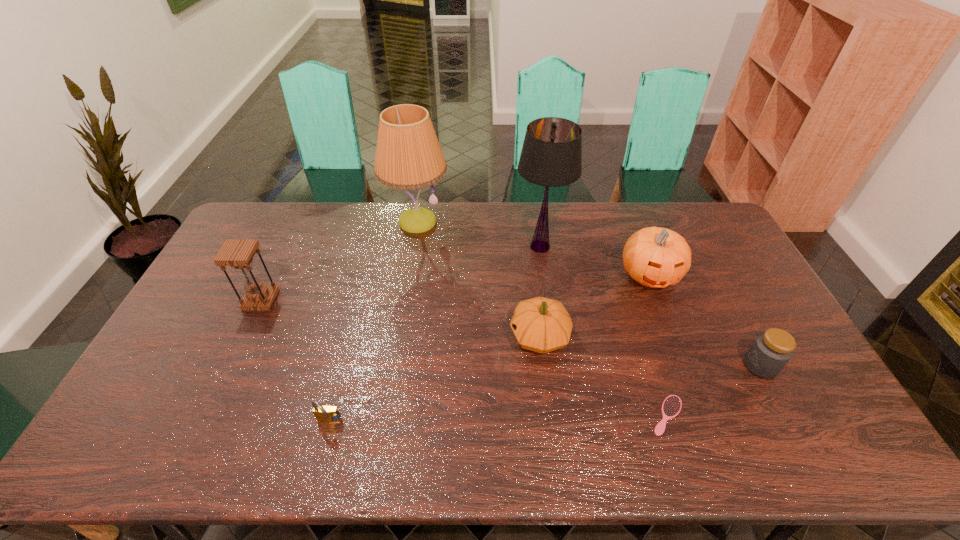
The height and width of the screenshot is (540, 960). Find the location of `free space located on the surface of the rightmost object near the warning symbol`. free space located on the surface of the rightmost object near the warning symbol is located at coordinates (630, 366).

What are the coordinates of `vacant area situated 0.070m on the side with the combination dials of the padlock` in the screenshot? It's located at (320, 457).

I want to click on free space located 0.370m on the back of the hairbrush, so click(628, 293).

The image size is (960, 540). Find the location of `lampshade that is at the far edge`. lampshade that is at the far edge is located at coordinates (551, 156).

Locate an element on the screen. The width and height of the screenshot is (960, 540). lamp present at the far edge is located at coordinates (408, 156).

Image resolution: width=960 pixels, height=540 pixels. What are the coordinates of `padlock present at the near edge` in the screenshot? It's located at (322, 413).

Locate an element on the screen. The image size is (960, 540). hairbrush situated at the near edge is located at coordinates (671, 406).

The image size is (960, 540). In order to click on object located in the right edge section of the desktop in this screenshot , I will do `click(771, 351)`.

Where is `free space at the far edge`? The height and width of the screenshot is (540, 960). free space at the far edge is located at coordinates (356, 219).

In the image, there is a desktop. Identify the location of free space at the near edge. Image resolution: width=960 pixels, height=540 pixels. (205, 463).